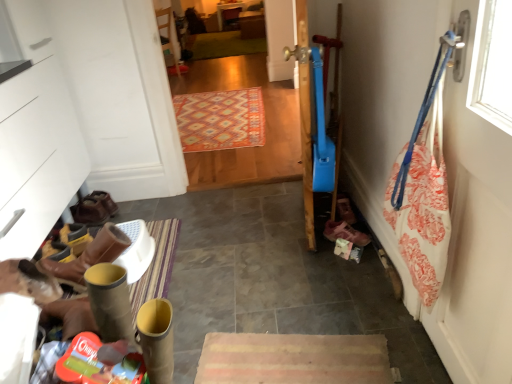
Question: Considering the relative positions of carpeted wooden floor at center and brown leather boots at lower left, which is counted as the second footwear, starting from the front, in the image provided, is carpeted wooden floor at center to the left or to the right of brown leather boots at lower left, which is counted as the second footwear, starting from the front,?

Choices:
 (A) left
 (B) right

Answer: (B)

Question: From the image's perspective, is carpeted wooden floor at center above or below brown leather boots at lower left, positioned as the second footwear in back-to-front order?

Choices:
 (A) above
 (B) below

Answer: (A)

Question: Which is farther from the brown leather boots at lower left, the 2th footwear positioned from the left?

Choices:
 (A) brown leather boots at lower left, which is counted as the second footwear, starting from the front
 (B) pink fabric shoe at lower right, which is the 1th footwear in front-to-back order
 (C) multicolored woven rug at center, the 1th mat viewed from the front
 (D) white fabric at right
 (E) carpeted wooden floor at center

Answer: (E)

Question: Which of these objects is positioned farthest from the carpeted wooden floor at center?

Choices:
 (A) brown leather boots at lower left, marked as the first footwear in a back-to-front arrangement
 (B) pink fabric shoe at lower right, which is the 1th footwear in front-to-back order
 (C) brown leather boots at lower left, the 1th footwear from the left
 (D) multicolored woven rug at center, the 1th mat viewed from the front
 (E) white fabric at right

Answer: (E)